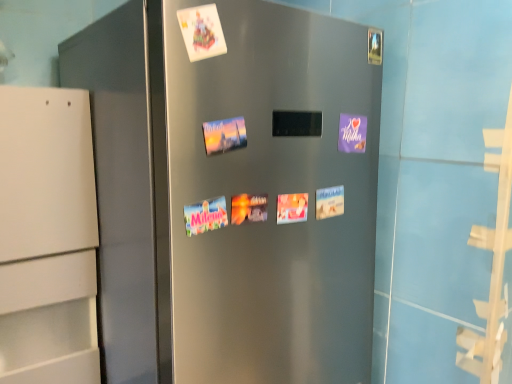
Question: From the image's perspective, does white paper at upper center appear lower than white paper postcard at center, acting as the 1th postcard starting from the bottom?

Choices:
 (A) yes
 (B) no

Answer: (B)

Question: Is white paper at upper center further to camera compared to white paper postcard at center, which is the 2th postcard in top-to-bottom order?

Choices:
 (A) yes
 (B) no

Answer: (B)

Question: Is white paper at upper center to the left of white paper postcard at center, acting as the 1th postcard starting from the bottom, from the viewer's perspective?

Choices:
 (A) yes
 (B) no

Answer: (A)

Question: Is white paper at upper center not inside white paper postcard at center, acting as the 1th postcard starting from the bottom?

Choices:
 (A) yes
 (B) no

Answer: (A)

Question: Is white paper at upper center wider than white paper postcard at center, acting as the 1th postcard starting from the bottom?

Choices:
 (A) no
 (B) yes

Answer: (B)

Question: Is purple matte postcard at upper right, arranged as the 1th postcard when viewed from the top, situated inside white paper postcard at center, which is the 2th postcard in top-to-bottom order, or outside?

Choices:
 (A) inside
 (B) outside

Answer: (B)

Question: From the image's perspective, relative to white paper postcard at center, acting as the 1th postcard starting from the bottom, is purple matte postcard at upper right, the 2th postcard positioned from the bottom, above or below?

Choices:
 (A) above
 (B) below

Answer: (A)

Question: In the image, is purple matte postcard at upper right, arranged as the 1th postcard when viewed from the top, on the left side or the right side of white paper postcard at center, acting as the 1th postcard starting from the bottom?

Choices:
 (A) left
 (B) right

Answer: (B)

Question: Relative to white paper postcard at center, acting as the 1th postcard starting from the bottom, is purple matte postcard at upper right, arranged as the 1th postcard when viewed from the top, in front or behind?

Choices:
 (A) behind
 (B) front

Answer: (A)

Question: From a real-world perspective, relative to white paper at upper center, is purple matte postcard at upper right, the 2th postcard positioned from the bottom, vertically above or below?

Choices:
 (A) below
 (B) above

Answer: (A)

Question: Is purple matte postcard at upper right, the 2th postcard positioned from the bottom, spatially inside white paper at upper center, or outside of it?

Choices:
 (A) inside
 (B) outside

Answer: (B)

Question: Is point (355, 115) closer or farther from the camera than point (214, 49)?

Choices:
 (A) farther
 (B) closer

Answer: (A)

Question: Looking at their shapes, would you say purple matte postcard at upper right, the 2th postcard positioned from the bottom, is wider or thinner than white paper at upper center?

Choices:
 (A) thin
 (B) wide

Answer: (A)

Question: From a real-world perspective, relative to white paper postcard at center, which is the 2th postcard in top-to-bottom order, is white paper at upper center vertically above or below?

Choices:
 (A) above
 (B) below

Answer: (A)

Question: In terms of width, does white paper at upper center look wider or thinner when compared to white paper postcard at center, acting as the 1th postcard starting from the bottom?

Choices:
 (A) thin
 (B) wide

Answer: (B)